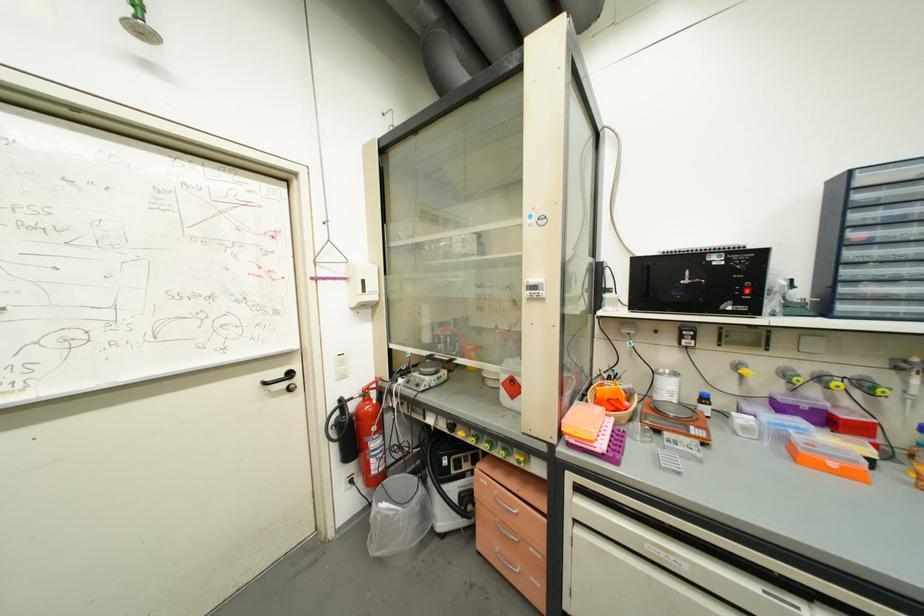
This screenshot has width=924, height=616. Identify the location of white light switch. (361, 285).